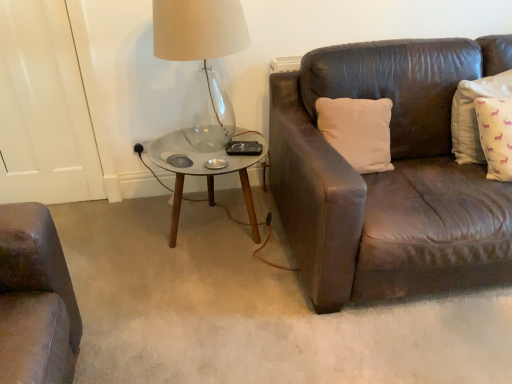
Question: Is yellow cotton pillow at right, which ranks as the second pillow in left-to-right order, outside transparent glass table lamp at upper left?

Choices:
 (A) yes
 (B) no

Answer: (A)

Question: Does yellow cotton pillow at right, placed as the 1th pillow when sorted from right to left, have a smaller size compared to transparent glass table lamp at upper left?

Choices:
 (A) no
 (B) yes

Answer: (B)

Question: Does yellow cotton pillow at right, placed as the 1th pillow when sorted from right to left, appear on the left side of transparent glass table lamp at upper left?

Choices:
 (A) yes
 (B) no

Answer: (B)

Question: Is the position of yellow cotton pillow at right, placed as the 1th pillow when sorted from right to left, more distant than that of transparent glass table lamp at upper left?

Choices:
 (A) yes
 (B) no

Answer: (A)

Question: Are yellow cotton pillow at right, placed as the 1th pillow when sorted from right to left, and transparent glass table lamp at upper left beside each other?

Choices:
 (A) yes
 (B) no

Answer: (B)

Question: From their relative heights in the image, would you say transparent glass table lamp at upper left is taller or shorter than metallic glass coffee table at center?

Choices:
 (A) short
 (B) tall

Answer: (B)

Question: Is transparent glass table lamp at upper left bigger or smaller than metallic glass coffee table at center?

Choices:
 (A) big
 (B) small

Answer: (B)

Question: From a real-world perspective, is transparent glass table lamp at upper left physically located above or below metallic glass coffee table at center?

Choices:
 (A) above
 (B) below

Answer: (A)

Question: Considering the positions of transparent glass table lamp at upper left and metallic glass coffee table at center in the image, is transparent glass table lamp at upper left wider or thinner than metallic glass coffee table at center?

Choices:
 (A) thin
 (B) wide

Answer: (A)

Question: From the image's perspective, is transparent glass table lamp at upper left located above or below yellow cotton pillow at right, placed as the 1th pillow when sorted from right to left?

Choices:
 (A) above
 (B) below

Answer: (A)

Question: Considering the positions of transparent glass table lamp at upper left and yellow cotton pillow at right, which ranks as the second pillow in left-to-right order, in the image, is transparent glass table lamp at upper left wider or thinner than yellow cotton pillow at right, which ranks as the second pillow in left-to-right order,?

Choices:
 (A) wide
 (B) thin

Answer: (A)

Question: Considering their positions, is transparent glass table lamp at upper left located in front of or behind yellow cotton pillow at right, placed as the 1th pillow when sorted from right to left?

Choices:
 (A) behind
 (B) front

Answer: (B)

Question: Based on their positions, is transparent glass table lamp at upper left located to the left or right of yellow cotton pillow at right, placed as the 1th pillow when sorted from right to left?

Choices:
 (A) right
 (B) left

Answer: (B)

Question: From their relative heights in the image, would you say white matte pillow at upper right, arranged as the 1th pillow when viewed from the left, is taller or shorter than transparent glass table lamp at upper left?

Choices:
 (A) tall
 (B) short

Answer: (B)

Question: Is white matte pillow at upper right, which is the 2th pillow from right to left, bigger or smaller than transparent glass table lamp at upper left?

Choices:
 (A) small
 (B) big

Answer: (A)